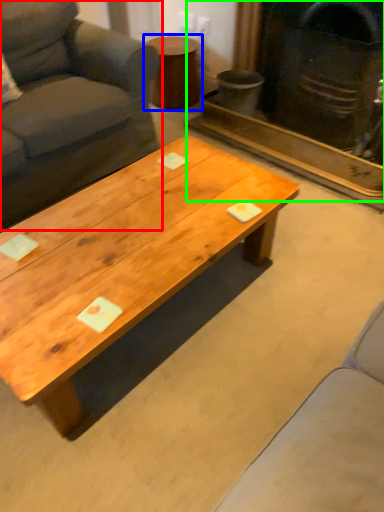
Question: Which is nearer to the studio couch (highlighted by a red box)? side table (highlighted by a blue box) or fireplace (highlighted by a green box).

Choices:
 (A) side table
 (B) fireplace

Answer: (A)